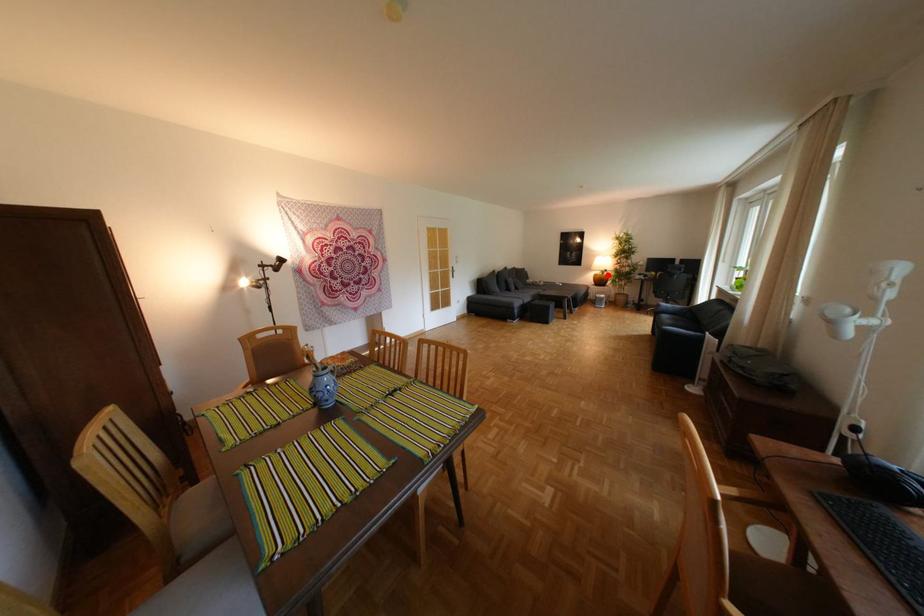
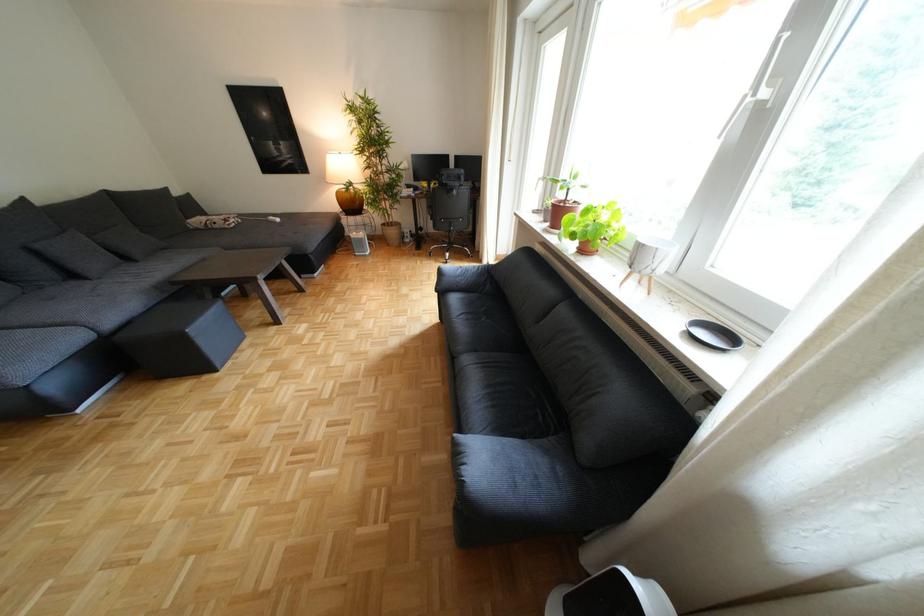
Question: I am providing you with two images of the same scene from different viewpoints. A red point is shown in image1. For the corresponding object point in image2, is it positioned nearer or farther from the camera?

Choices:
 (A) Nearer
 (B) Farther

Answer: (A)